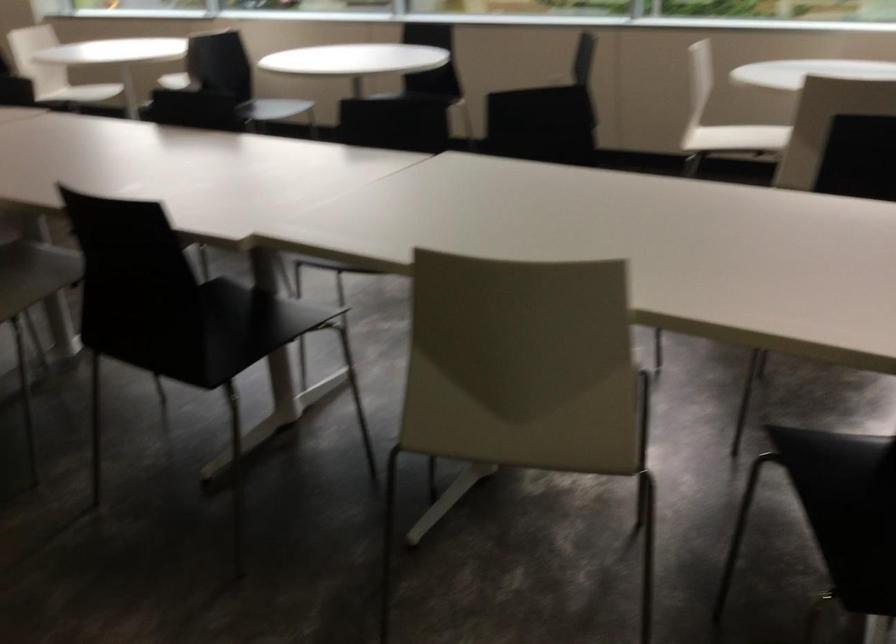
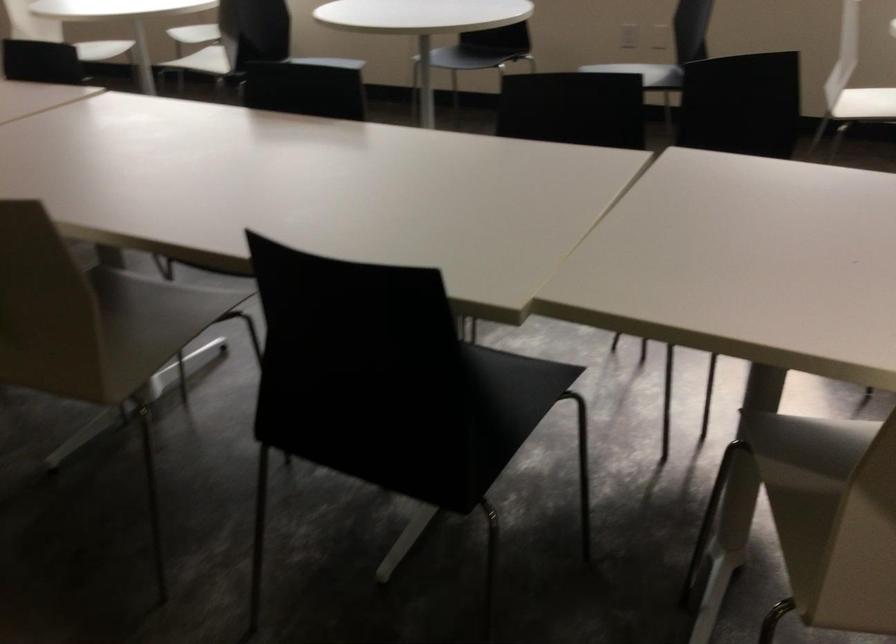
In the second image, find the point that corresponds to point (403, 371) in the first image.

(831, 516)